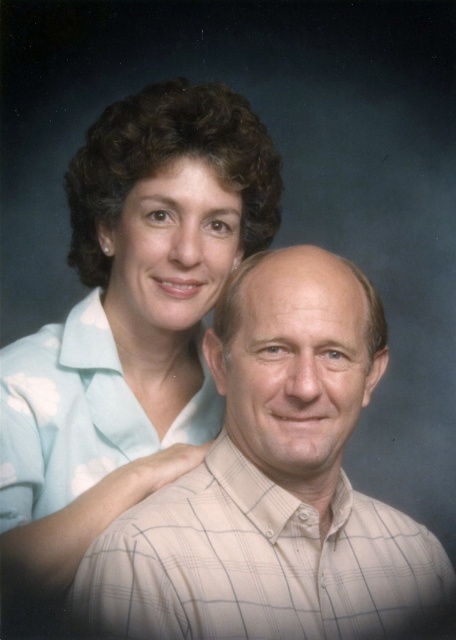
Question: Which of the following is the closest to the observer?

Choices:
 (A) light blue fabric at upper left
 (B) white checkered shirt at center

Answer: (B)

Question: Can you confirm if white checkered shirt at center is bigger than light blue fabric at upper left?

Choices:
 (A) yes
 (B) no

Answer: (B)

Question: Which point appears farthest from the camera in this image?

Choices:
 (A) (1, 385)
 (B) (100, 598)

Answer: (A)

Question: Is the position of white checkered shirt at center more distant than that of light blue fabric at upper left?

Choices:
 (A) yes
 (B) no

Answer: (B)

Question: Can you confirm if white checkered shirt at center is positioned below light blue fabric at upper left?

Choices:
 (A) yes
 (B) no

Answer: (A)